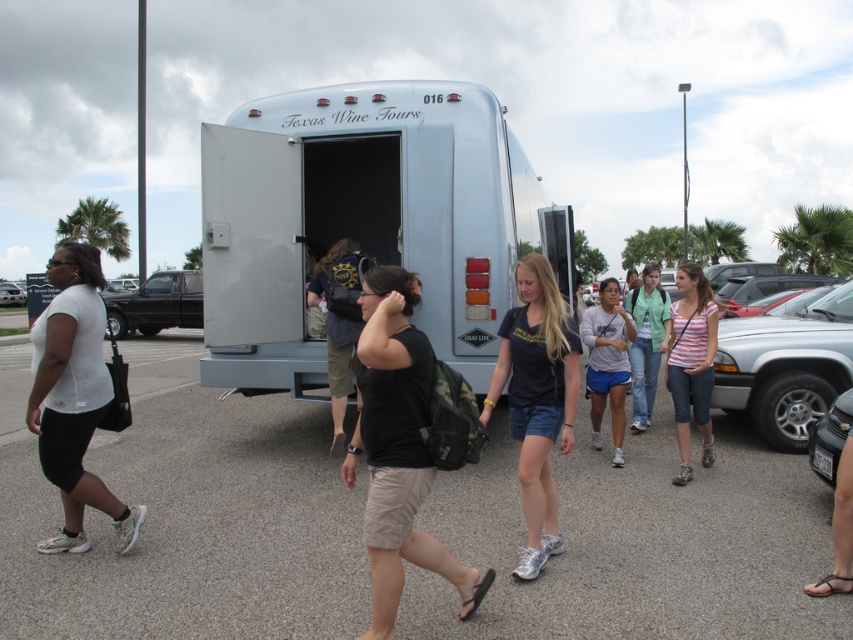
In the scene shown: You are standing at the point closest to the bus labeled Texas Wine Tours 016. Which of the two points, point (451,356) or point (62,406), is farther away from you?

Point (451,356) is behind point (62,406), so if you are standing at the point closest to the bus, point (451,356) is farther away from you.

You are a photographer trying to capture a photo of the white metallic bus at center and the white matte shirt at left. Considering their sizes, which object should you focus on first to ensure it appears larger in the photo?

The white metallic bus at center is much taller than the white matte shirt at left, so you should focus on the white metallic bus at center first to ensure it appears larger in the photo.

You are a tour guide at the Texas Wine Tours bus. You notice a matte black truck at left and a light green shirt at center in the scene. Which object is positioned higher in the image?

The matte black truck at left is positioned higher than the light green shirt at center in the image.